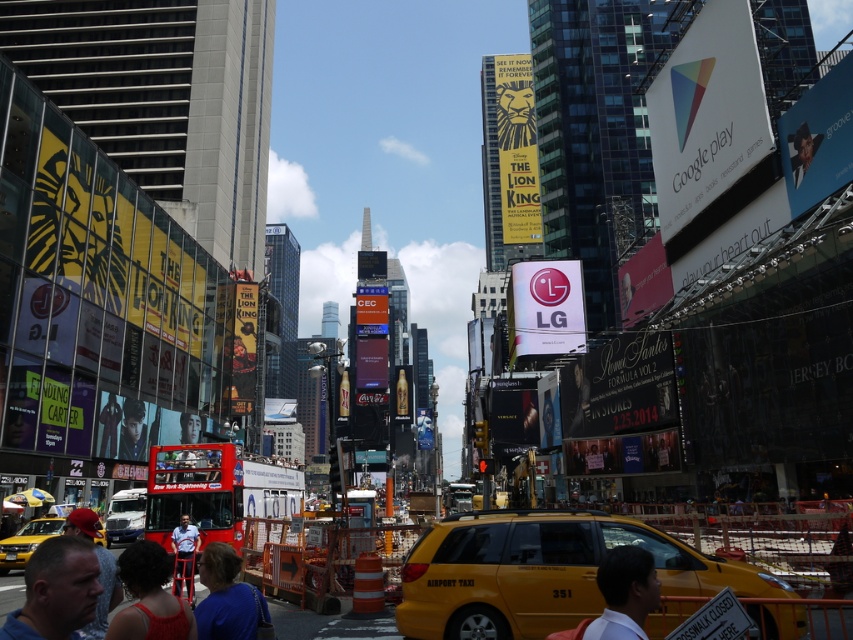
Does point (564, 340) come farther from viewer compared to point (634, 570)?

Yes, it is.

Can you confirm if white glossy lg sign at center is positioned below white matte shirt at lower center?

Actually, white glossy lg sign at center is above white matte shirt at lower center.

Where is `white glossy lg sign at center`? white glossy lg sign at center is located at coordinates click(x=544, y=308).

Image resolution: width=853 pixels, height=640 pixels. What are the coordinates of `white glossy lg sign at center` in the screenshot? It's located at (544, 308).

Is red cap at lower left taller than white shirt at center?

In fact, red cap at lower left may be shorter than white shirt at center.

At what (x,y) coordinates should I click in order to perform the action: click on red cap at lower left. Please return your answer as a coordinate pair (x, y). The height and width of the screenshot is (640, 853). Looking at the image, I should click on (103, 595).

Does white glossy lg sign at center appear on the left side of matte red dress at lower left?

Incorrect, white glossy lg sign at center is not on the left side of matte red dress at lower left.

Where is `white glossy lg sign at center`? The width and height of the screenshot is (853, 640). white glossy lg sign at center is located at coordinates (544, 308).

Where is `white glossy lg sign at center`? white glossy lg sign at center is located at coordinates (544, 308).